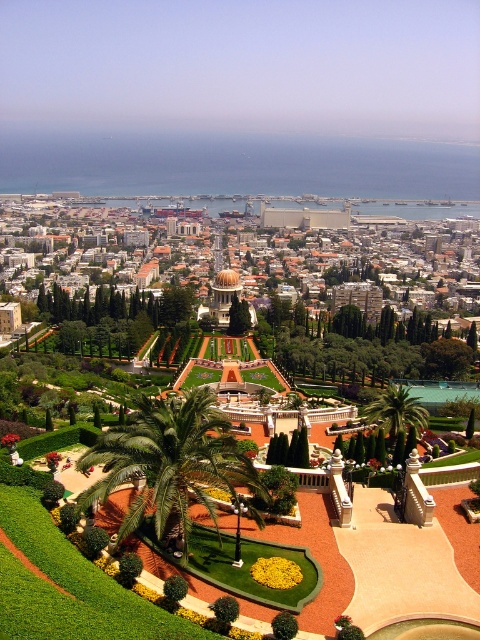
How distant is green leafy palm at center from green leafy palm tree at center?

46.67 meters

Is green leafy palm at center wider than green leafy palm tree at center?

Yes.

The image size is (480, 640). What are the coordinates of `green leafy palm at center` in the screenshot? It's located at (169, 464).

Can you confirm if matte gold dome at center is positioned to the left of green leafy palm at center?

In fact, matte gold dome at center is to the right of green leafy palm at center.

Which is behind, point (263, 278) or point (214, 522)?

The point (263, 278) is more distant.

Locate an element on the screen. matte gold dome at center is located at coordinates (240, 257).

Is matte gold dome at center above green leafy palm tree at center?

Indeed, matte gold dome at center is positioned over green leafy palm tree at center.

Is matte gold dome at center thinner than green leafy palm tree at center?

No, matte gold dome at center is not thinner than green leafy palm tree at center.

Who is more distant from viewer, (88, 314) or (423, 422)?

Point (88, 314)

This screenshot has width=480, height=640. I want to click on matte gold dome at center, so [240, 257].